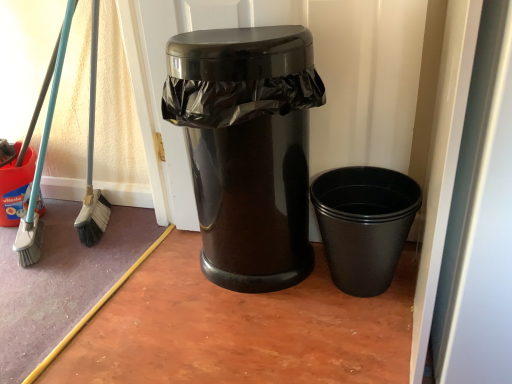
What do you see at coordinates (364, 224) in the screenshot? I see `black plastic cup at lower right, positioned as the 1th waste container in right-to-left order` at bounding box center [364, 224].

Where is `glossy black trash can at center, arranged as the second waste container when viewed from the right`? glossy black trash can at center, arranged as the second waste container when viewed from the right is located at coordinates point(247,148).

Image resolution: width=512 pixels, height=384 pixels. Find the location of `black plastic cup at lower right, positioned as the 1th waste container in right-to-left order`. black plastic cup at lower right, positioned as the 1th waste container in right-to-left order is located at coordinates (364, 224).

Is glossy plastic trash can at center far from black plastic cup at lower right, positioned as the 1th waste container in right-to-left order?

No, glossy plastic trash can at center is not far away from black plastic cup at lower right, positioned as the 1th waste container in right-to-left order.

Is glossy plastic trash can at center aimed at black plastic cup at lower right, acting as the 2th waste container starting from the left?

Yes.

From the image's perspective, is glossy plastic trash can at center under black plastic cup at lower right, positioned as the 1th waste container in right-to-left order?

No, from the image's perspective, glossy plastic trash can at center is not beneath black plastic cup at lower right, positioned as the 1th waste container in right-to-left order.

Between glossy black trash can at center, the 1th waste container in the left-to-right sequence, and black plastic cup at lower right, acting as the 2th waste container starting from the left, which one is positioned behind?

black plastic cup at lower right, acting as the 2th waste container starting from the left, is more distant.

Considering the relative sizes of glossy black trash can at center, the 1th waste container in the left-to-right sequence, and black plastic cup at lower right, acting as the 2th waste container starting from the left, in the image provided, is glossy black trash can at center, the 1th waste container in the left-to-right sequence, wider than black plastic cup at lower right, acting as the 2th waste container starting from the left,?

No.

From the image's perspective, relative to black plastic cup at lower right, positioned as the 1th waste container in right-to-left order, is glossy black trash can at center, arranged as the second waste container when viewed from the right, above or below?

glossy black trash can at center, arranged as the second waste container when viewed from the right, is situated higher than black plastic cup at lower right, positioned as the 1th waste container in right-to-left order, in the image.

Is glossy black trash can at center, arranged as the second waste container when viewed from the right, at the right side of black plastic cup at lower right, positioned as the 1th waste container in right-to-left order?

No, glossy black trash can at center, arranged as the second waste container when viewed from the right, is not to the right of black plastic cup at lower right, positioned as the 1th waste container in right-to-left order.

Considering the sizes of glossy plastic trash can at center and glossy black trash can at center, arranged as the second waste container when viewed from the right, in the image, is glossy plastic trash can at center taller or shorter than glossy black trash can at center, arranged as the second waste container when viewed from the right,?

Clearly, glossy plastic trash can at center is taller compared to glossy black trash can at center, arranged as the second waste container when viewed from the right.

Is glossy black trash can at center, the 1th waste container in the left-to-right sequence, surrounded by glossy plastic trash can at center?

No.

Is the position of glossy plastic trash can at center less distant than that of glossy black trash can at center, arranged as the second waste container when viewed from the right?

That is False.

From the picture: Is glossy plastic trash can at center facing towards glossy black trash can at center, arranged as the second waste container when viewed from the right?

Yes, glossy plastic trash can at center is oriented towards glossy black trash can at center, arranged as the second waste container when viewed from the right.

Which object is more forward, glossy black trash can at center, arranged as the second waste container when viewed from the right, or glossy plastic trash can at center?

glossy black trash can at center, arranged as the second waste container when viewed from the right, is more forward.

What's the angular difference between glossy black trash can at center, arranged as the second waste container when viewed from the right, and glossy plastic trash can at center's facing directions?

They differ by 0.00153 degrees in their facing directions.

Considering the relative positions of glossy black trash can at center, arranged as the second waste container when viewed from the right, and glossy plastic trash can at center in the image provided, is glossy black trash can at center, arranged as the second waste container when viewed from the right, to the left of glossy plastic trash can at center from the viewer's perspective?

Yes.

Is black plastic cup at lower right, positioned as the 1th waste container in right-to-left order, turned away from glossy plastic trash can at center?

Yes, black plastic cup at lower right, positioned as the 1th waste container in right-to-left order, is facing away from glossy plastic trash can at center.

Locate an element on the screen. This screenshot has height=384, width=512. screen door located behind the black plastic cup at lower right, positioned as the 1th waste container in right-to-left order is located at coordinates (316, 68).

Can we say black plastic cup at lower right, acting as the 2th waste container starting from the left, lies outside glossy plastic trash can at center?

Yes.

Does point (370, 255) come behind point (348, 131)?

No, it is in front of (348, 131).

How distant is black plastic cup at lower right, acting as the 2th waste container starting from the left, from glossy black trash can at center, the 1th waste container in the left-to-right sequence?

black plastic cup at lower right, acting as the 2th waste container starting from the left, is 9.28 inches away from glossy black trash can at center, the 1th waste container in the left-to-right sequence.

Which of these two, black plastic cup at lower right, acting as the 2th waste container starting from the left, or glossy black trash can at center, the 1th waste container in the left-to-right sequence, is bigger?

Bigger between the two is glossy black trash can at center, the 1th waste container in the left-to-right sequence.

Relative to glossy black trash can at center, the 1th waste container in the left-to-right sequence, is black plastic cup at lower right, positioned as the 1th waste container in right-to-left order, in front or behind?

black plastic cup at lower right, positioned as the 1th waste container in right-to-left order, is behind glossy black trash can at center, the 1th waste container in the left-to-right sequence.

Where is `waste container on the left side of black plastic cup at lower right, positioned as the 1th waste container in right-to-left order`? waste container on the left side of black plastic cup at lower right, positioned as the 1th waste container in right-to-left order is located at coordinates (x=247, y=148).

From a real-world perspective, count 2nd waste containers downward from the glossy plastic trash can at center and point to it. Please provide its 2D coordinates.

[(364, 224)]

Where is `waste container behind the glossy black trash can at center, the 1th waste container in the left-to-right sequence`? waste container behind the glossy black trash can at center, the 1th waste container in the left-to-right sequence is located at coordinates (364, 224).

Based on the photo, considering their positions, is glossy black trash can at center, arranged as the second waste container when viewed from the right, positioned closer to black plastic cup at lower right, acting as the 2th waste container starting from the left, than glossy plastic trash can at center?

Based on the image, glossy black trash can at center, arranged as the second waste container when viewed from the right, appears to be nearer to black plastic cup at lower right, acting as the 2th waste container starting from the left.

Estimate the real-world distances between objects in this image. Which object is closer to glossy black trash can at center, arranged as the second waste container when viewed from the right, glossy plastic trash can at center or black plastic cup at lower right, acting as the 2th waste container starting from the left?

glossy plastic trash can at center.

Which object lies further to the anchor point glossy black trash can at center, the 1th waste container in the left-to-right sequence, black plastic cup at lower right, acting as the 2th waste container starting from the left, or glossy plastic trash can at center?

black plastic cup at lower right, acting as the 2th waste container starting from the left, lies further to glossy black trash can at center, the 1th waste container in the left-to-right sequence, than the other object.

Which object lies further to the anchor point glossy plastic trash can at center, glossy black trash can at center, arranged as the second waste container when viewed from the right, or black plastic cup at lower right, positioned as the 1th waste container in right-to-left order?

black plastic cup at lower right, positioned as the 1th waste container in right-to-left order, lies further to glossy plastic trash can at center than the other object.

Looking at this image, considering their positions, is glossy plastic trash can at center positioned closer to black plastic cup at lower right, positioned as the 1th waste container in right-to-left order, than glossy black trash can at center, the 1th waste container in the left-to-right sequence?

glossy black trash can at center, the 1th waste container in the left-to-right sequence, lies closer to black plastic cup at lower right, positioned as the 1th waste container in right-to-left order, than the other object.

Estimate the real-world distances between objects in this image. Which object is closer to glossy plastic trash can at center, black plastic cup at lower right, acting as the 2th waste container starting from the left, or glossy black trash can at center, arranged as the second waste container when viewed from the right?

The object closer to glossy plastic trash can at center is glossy black trash can at center, arranged as the second waste container when viewed from the right.

Locate an element on the screen. screen door situated between glossy black trash can at center, the 1th waste container in the left-to-right sequence, and black plastic cup at lower right, acting as the 2th waste container starting from the left, from left to right is located at coordinates (316, 68).